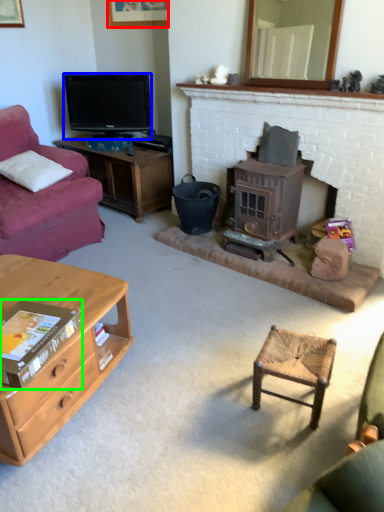
Question: Based on their relative distances, which object is farther from picture frame (highlighted by a red box)? Choose from television (highlighted by a blue box) and book (highlighted by a green box).

Choices:
 (A) television
 (B) book

Answer: (B)